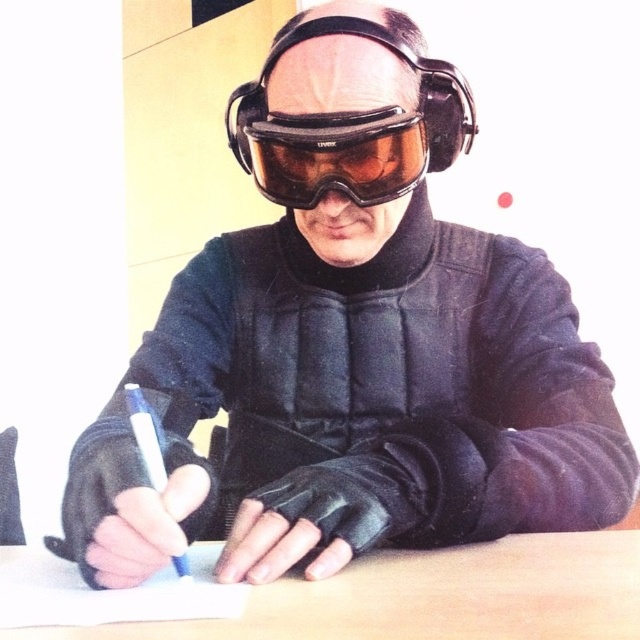
Question: Can you confirm if wooden table at center is positioned below matte black helmet at center?

Choices:
 (A) no
 (B) yes

Answer: (B)

Question: Which object is farther from the camera taking this photo?

Choices:
 (A) matte black helmet at center
 (B) blue plastic pen at center
 (C) wooden table at center
 (D) brown matte/glossy goggles at center

Answer: (D)

Question: Among these objects, which one is nearest to the camera?

Choices:
 (A) matte black helmet at center
 (B) blue plastic pen at center

Answer: (B)

Question: Is wooden table at center to the left of blue plastic pen at center from the viewer's perspective?

Choices:
 (A) no
 (B) yes

Answer: (A)

Question: From the image, what is the correct spatial relationship of wooden table at center in relation to blue plastic pen at center?

Choices:
 (A) left
 (B) right

Answer: (B)

Question: Based on their relative distances, which object is farther from the brown matte/glossy goggles at center?

Choices:
 (A) blue plastic pen at center
 (B) matte black helmet at center
 (C) wooden table at center

Answer: (C)